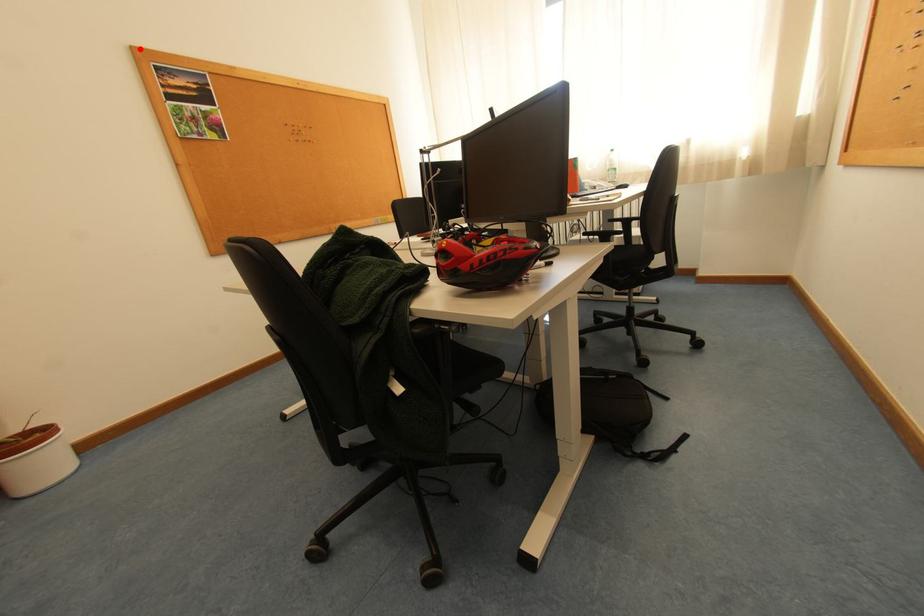
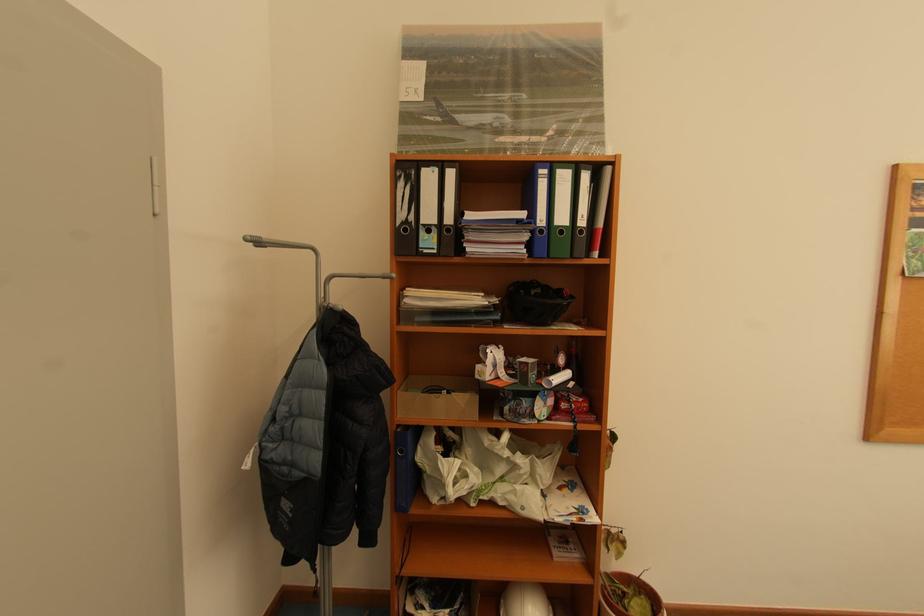
Where in the second image is the point corresponding to the highlighted location from the first image?

(904, 167)